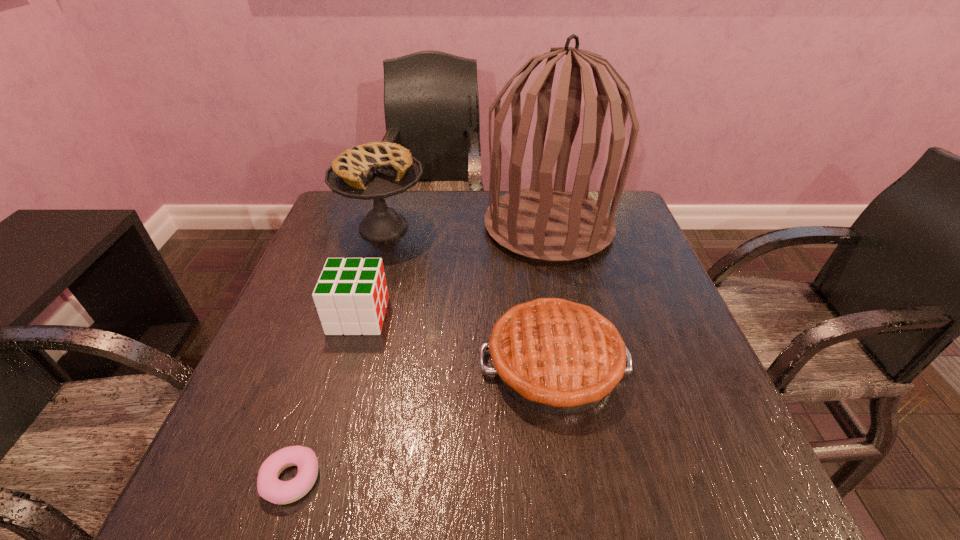
The image size is (960, 540). Identify the location of vacant space located 0.050m on the red face of the cube. (409, 315).

You are a GUI agent. You are given a task and a screenshot of the screen. Output one action in this format:
    pyautogui.click(x=<x>, y=<y>)
    Task: Click on the free region located on the back of the shorter pie
    The width and height of the screenshot is (960, 540).
    Given the screenshot: What is the action you would take?
    537,256

The image size is (960, 540). In order to click on free space located 0.060m on the left of the pastry in this screenshot , I will do `click(224, 480)`.

Image resolution: width=960 pixels, height=540 pixels. Identify the location of birdcage positioned at the far edge. tap(552, 224).

The image size is (960, 540). What are the coordinates of `pie that is at the far edge` in the screenshot? It's located at (377, 170).

Where is `object that is at the near edge`? object that is at the near edge is located at coordinates (269, 487).

Where is `pie located in the left edge section of the desktop`? The height and width of the screenshot is (540, 960). pie located in the left edge section of the desktop is located at coordinates (377, 170).

Locate an element on the screen. cube that is at the left edge is located at coordinates (351, 296).

Where is `pastry present at the left edge`? This screenshot has width=960, height=540. pastry present at the left edge is located at coordinates (269, 487).

Locate an element on the screen. This screenshot has height=540, width=960. birdcage that is at the right edge is located at coordinates (552, 224).